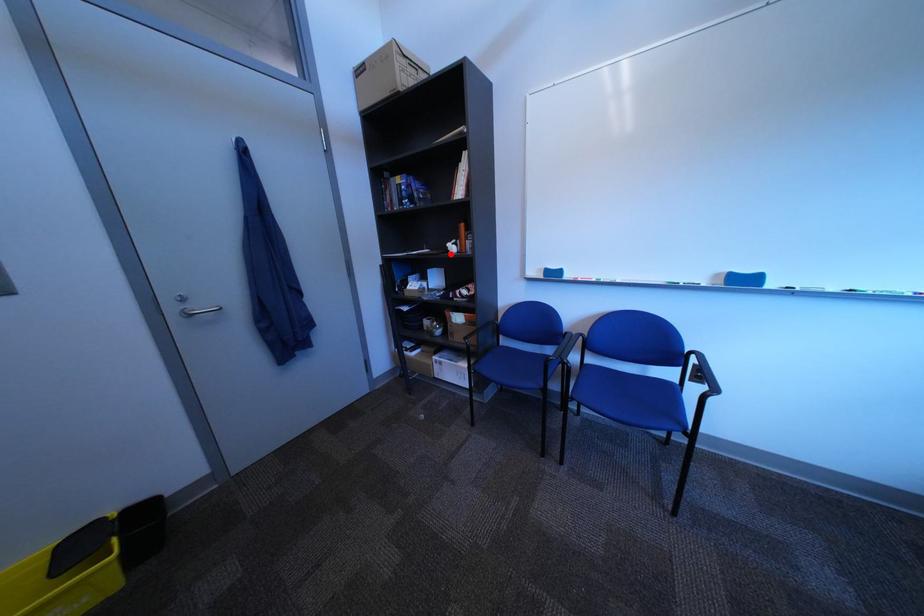
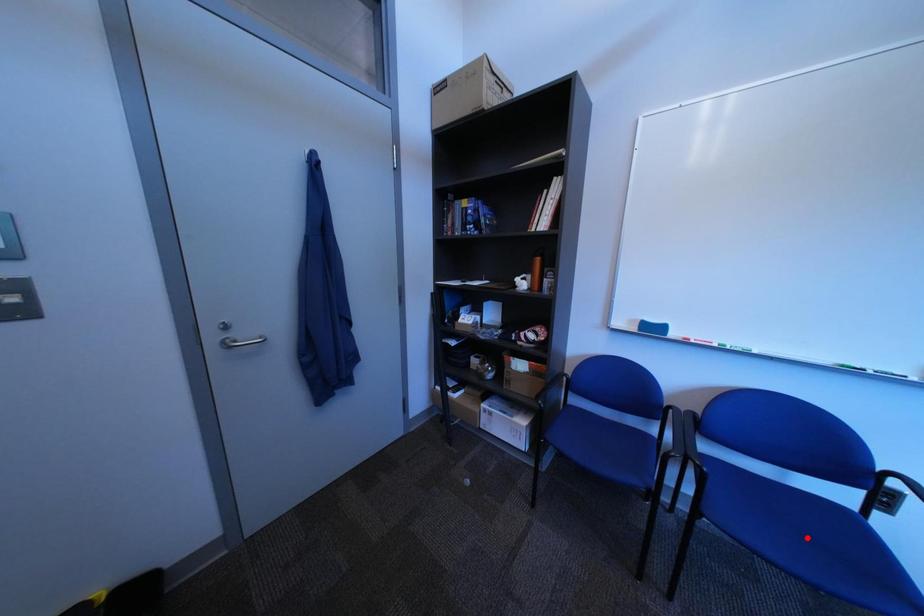
I am providing you with two images of the same scene from different viewpoints. A red point is marked on the first image and another point is marked on the second image. Do the highlighted points in image1 and image2 indicate the same real-world spot?

No